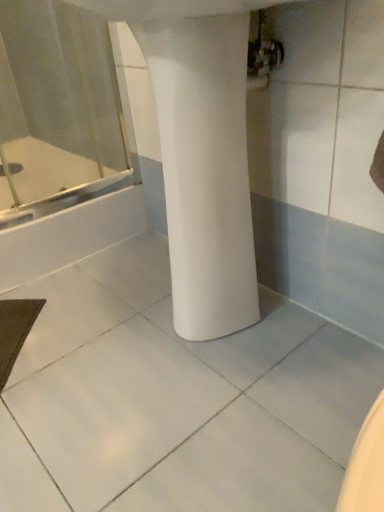
Question: Can you confirm if white glossy bathtub at left is positioned to the right of white matte column at center?

Choices:
 (A) no
 (B) yes

Answer: (A)

Question: Is white glossy bathtub at left outside white matte column at center?

Choices:
 (A) no
 (B) yes

Answer: (B)

Question: Is white glossy bathtub at left placed right next to white matte column at center?

Choices:
 (A) no
 (B) yes

Answer: (A)

Question: Considering the relative sizes of white glossy bathtub at left and white matte column at center in the image provided, is white glossy bathtub at left taller than white matte column at center?

Choices:
 (A) no
 (B) yes

Answer: (A)

Question: From the image's perspective, would you say white glossy bathtub at left is shown under white matte column at center?

Choices:
 (A) yes
 (B) no

Answer: (B)

Question: Is white matte column at center inside white glossy bathtub at left?

Choices:
 (A) yes
 (B) no

Answer: (B)

Question: Is white matte column at center closer to the viewer compared to white glossy bathtub at left?

Choices:
 (A) no
 (B) yes

Answer: (B)

Question: Is the depth of white matte column at center greater than that of white glossy bathtub at left?

Choices:
 (A) yes
 (B) no

Answer: (B)

Question: From the image's perspective, is white matte column at center on white glossy bathtub at left?

Choices:
 (A) yes
 (B) no

Answer: (B)

Question: Does white matte column at center have a smaller size compared to white glossy bathtub at left?

Choices:
 (A) yes
 (B) no

Answer: (A)

Question: Considering the relative sizes of white matte column at center and white glossy bathtub at left in the image provided, is white matte column at center thinner than white glossy bathtub at left?

Choices:
 (A) yes
 (B) no

Answer: (A)

Question: Is white matte column at center with white glossy bathtub at left?

Choices:
 (A) yes
 (B) no

Answer: (B)

Question: In terms of size, does white matte column at center appear bigger or smaller than white glossy bathtub at left?

Choices:
 (A) small
 (B) big

Answer: (A)